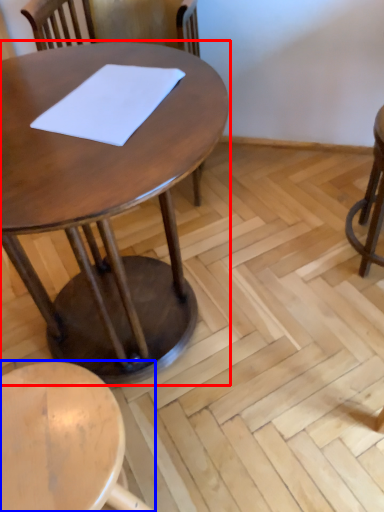
Question: Which object appears farthest to the camera in this image, table (highlighted by a red box) or stool (highlighted by a blue box)?

Choices:
 (A) table
 (B) stool

Answer: (B)